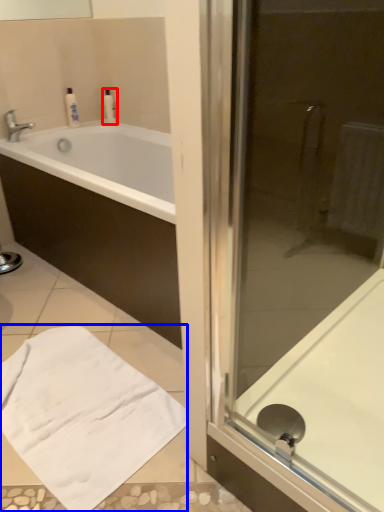
Question: Which point is closer to the camera, toiletry (highlighted by a red box) or bath towel (highlighted by a blue box)?

Choices:
 (A) toiletry
 (B) bath towel

Answer: (B)